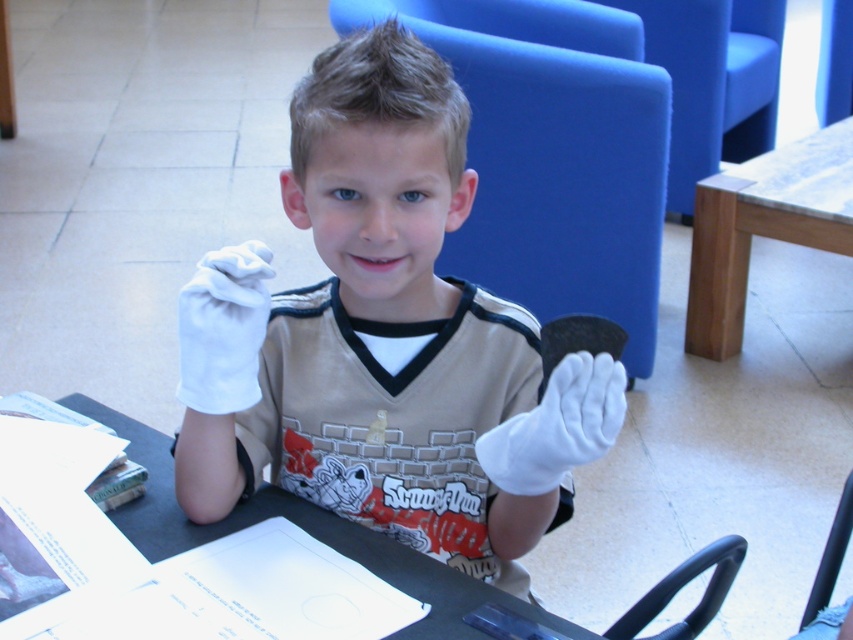
Does black glossy table at center appear over white cotton glove at center?

No, black glossy table at center is not above white cotton glove at center.

Can you confirm if black glossy table at center is thinner than white cotton glove at center?

No, black glossy table at center is not thinner than white cotton glove at center.

Measure the distance between black glossy table at center and camera.

The distance of black glossy table at center from camera is 38.53 inches.

At what (x,y) coordinates should I click in order to perform the action: click on black glossy table at center. Please return your answer as a coordinate pair (x, y). Image resolution: width=853 pixels, height=640 pixels. Looking at the image, I should click on point(305,529).

Between wooden at right and black plastic chair at lower right, which one has less height?

black plastic chair at lower right

Is wooden at right closer to the viewer compared to black plastic chair at lower right?

No.

Where is `wooden at right`? wooden at right is located at coordinates (763, 227).

The image size is (853, 640). Identify the location of wooden at right. (763, 227).

Which is below, wooden at right or white cotton glove at center?

white cotton glove at center

Does wooden at right come in front of white cotton glove at center?

No, it is not.

I want to click on wooden at right, so click(x=763, y=227).